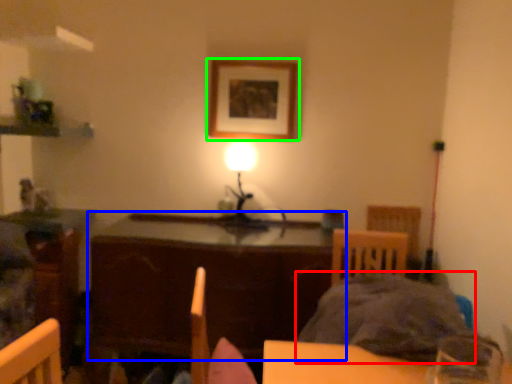
Question: Which is nearer to the bedding (highlighted by a red box)? table (highlighted by a blue box) or picture frame (highlighted by a green box).

Choices:
 (A) table
 (B) picture frame

Answer: (A)